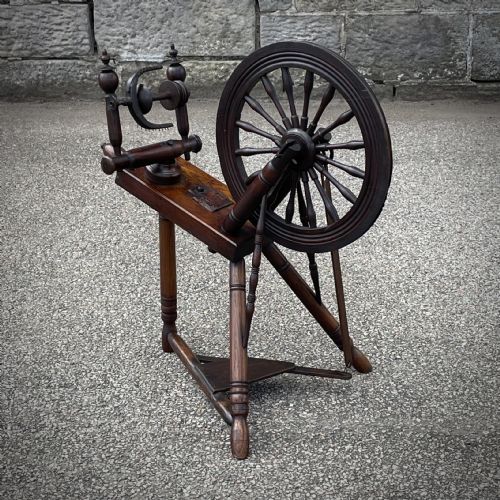
You are a GUI agent. You are given a task and a screenshot of the screen. Output one action in this format:
    pyautogui.click(x=<x>, y=<y>)
    Task: Click on the decorative posts
    This screenshot has height=500, width=500.
    Given the screenshot: What is the action you would take?
    pyautogui.click(x=109, y=103), pyautogui.click(x=179, y=73)